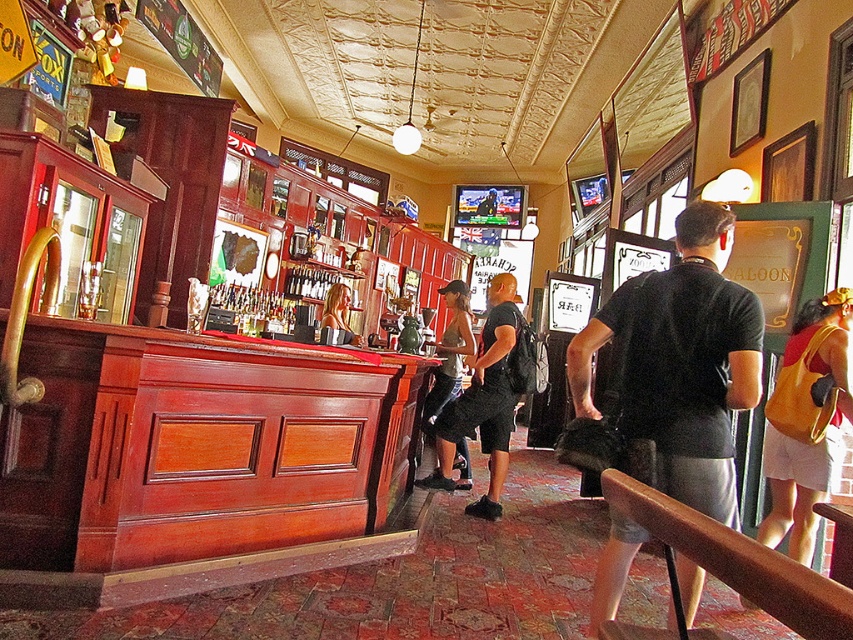
Question: Does orange fabric bag at right have a larger size compared to denim shorts at center?

Choices:
 (A) yes
 (B) no

Answer: (B)

Question: Which point is farther to the camera?

Choices:
 (A) (344, 294)
 (B) (515, 324)
 (C) (721, 410)
 (D) (467, 458)

Answer: (A)

Question: Which point is farther to the camera?

Choices:
 (A) smooth blonde hair at center
 (B) denim shorts at center
 (C) brown wood at lower right

Answer: (B)

Question: Is orange fabric bag at right above smooth blonde hair at center?

Choices:
 (A) yes
 (B) no

Answer: (B)

Question: Among these objects, which one is nearest to the camera?

Choices:
 (A) smooth blonde hair at center
 (B) denim shorts at center

Answer: (A)

Question: Can you confirm if denim shorts at center is positioned below smooth blonde hair at center?

Choices:
 (A) no
 (B) yes

Answer: (B)